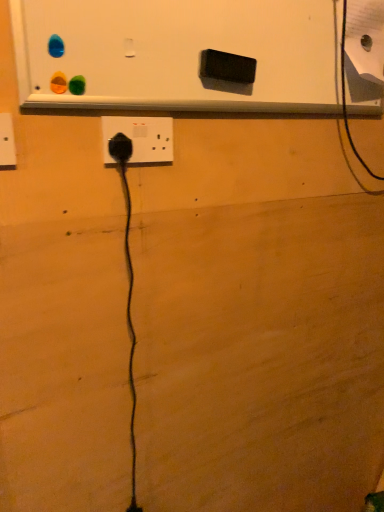
Question: In the image, is white matte bulletin board at upper center positioned in front of or behind black plastic power plug at left, the third power plugs and sockets from the back?

Choices:
 (A) behind
 (B) front

Answer: (B)

Question: Is white matte bulletin board at upper center taller or shorter than black plastic power plug at left, the third power plugs and sockets from the right?

Choices:
 (A) tall
 (B) short

Answer: (A)

Question: Which of these objects is positioned farthest from the black plastic power plug at center, marked as the 2th power plugs and sockets in a back-to-front arrangement?

Choices:
 (A) black rubber power plug at center, the second power plugs and sockets from the right
 (B) white matte bulletin board at upper center
 (C) black plastic power plug at left, which is the 1th power plugs and sockets in left-to-right order

Answer: (C)

Question: Which object is positioned closest to the black plastic power plug at center, the third power plugs and sockets from the left?

Choices:
 (A) black rubber power plug at center, marked as the 2th power plugs and sockets in a left-to-right arrangement
 (B) black plastic power plug at left, the third power plugs and sockets from the right
 (C) white matte bulletin board at upper center

Answer: (A)